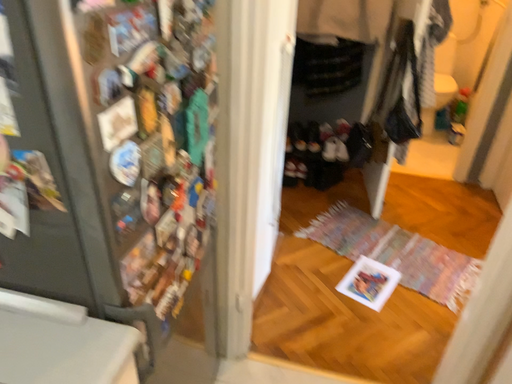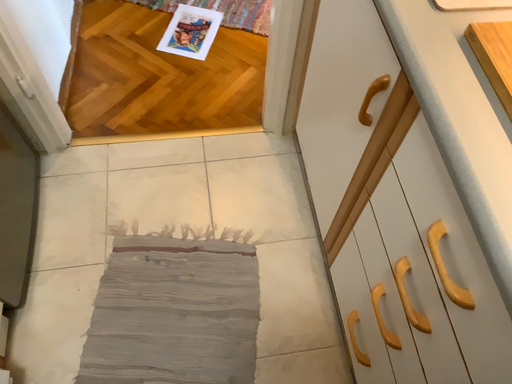
Question: How did the camera likely rotate when shooting the video?

Choices:
 (A) rotated right
 (B) rotated left

Answer: (A)